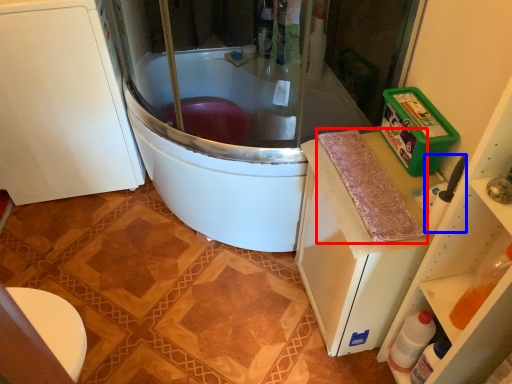
Question: Among these objects, which one is nearest to the camera, material (highlighted by a red box) or appliance (highlighted by a blue box)?

Choices:
 (A) material
 (B) appliance

Answer: (B)